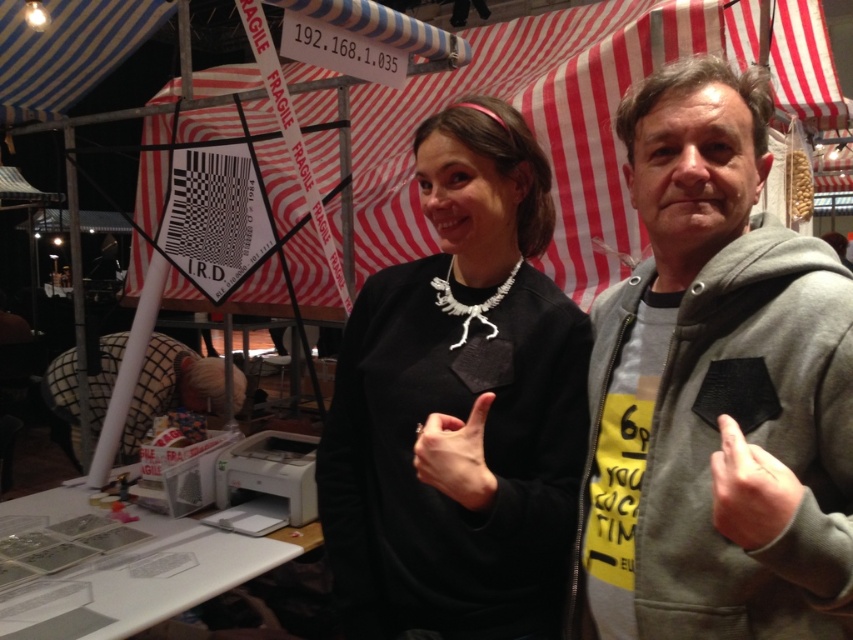
Does black matte sweatshirt at center have a greater height compared to plaid fabric man at lower left?

Yes, black matte sweatshirt at center is taller than plaid fabric man at lower left.

Does black matte sweatshirt at center appear under plaid fabric man at lower left?

Incorrect, black matte sweatshirt at center is not positioned below plaid fabric man at lower left.

Between point (567, 444) and point (184, 404), which one is positioned in front?

Point (567, 444) is in front.

At what (x,y) coordinates should I click in order to perform the action: click on black matte sweatshirt at center. Please return your answer as a coordinate pair (x, y). The image size is (853, 640). Looking at the image, I should click on (459, 404).

Based on the photo, can you confirm if plaid fabric man at lower left is wider than matte black hand at center?

Yes.

From the picture: Can you confirm if plaid fabric man at lower left is thinner than matte black hand at center?

In fact, plaid fabric man at lower left might be wider than matte black hand at center.

Between point (77, 454) and point (459, 468), which one is positioned in front?

Point (459, 468) is in front.

The image size is (853, 640). I want to click on plaid fabric man at lower left, so click(x=170, y=388).

Is black matte sweatshirt at center above matte black hand at center?

Indeed, black matte sweatshirt at center is positioned over matte black hand at center.

Can you confirm if black matte sweatshirt at center is bigger than matte black hand at center?

Indeed, black matte sweatshirt at center has a larger size compared to matte black hand at center.

Who is more forward, (404, 460) or (448, 477)?

Point (448, 477) is in front.

Where is `black matte sweatshirt at center`? This screenshot has width=853, height=640. black matte sweatshirt at center is located at coordinates (459, 404).